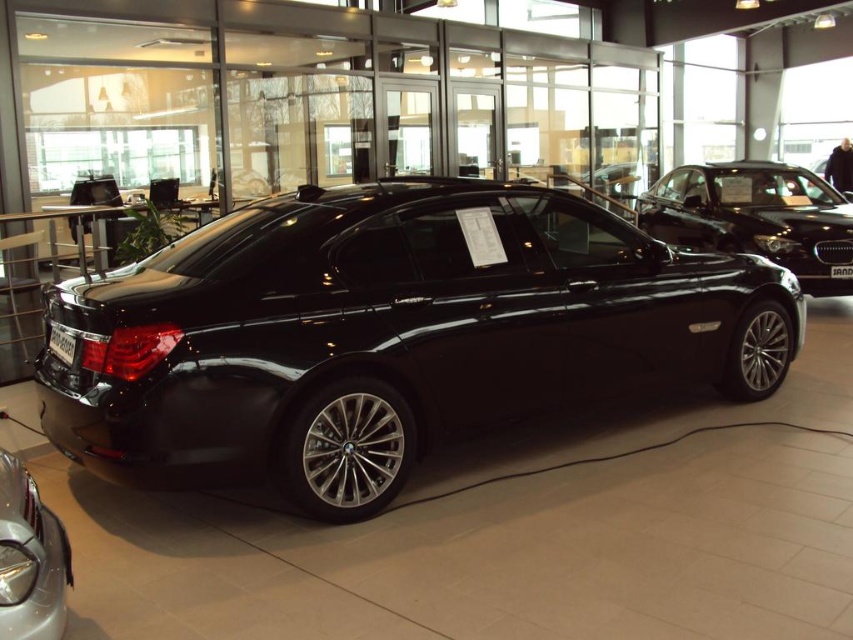
Between glossy black sedan at upper right and metallic silver car at lower left, which one appears on the right side from the viewer's perspective?

glossy black sedan at upper right is more to the right.

Who is positioned more to the left, glossy black sedan at upper right or metallic silver car at lower left?

From the viewer's perspective, metallic silver car at lower left appears more on the left side.

At what (x,y) coordinates should I click in order to perform the action: click on glossy black sedan at upper right. Please return your answer as a coordinate pair (x, y). The width and height of the screenshot is (853, 640). Looking at the image, I should click on (756, 218).

I want to click on glossy black sedan at upper right, so click(756, 218).

Can you confirm if black metallic car at center is positioned to the right of metallic silver car at lower left?

Yes, black metallic car at center is to the right of metallic silver car at lower left.

Is black metallic car at center to the left of metallic silver car at lower left from the viewer's perspective?

No, black metallic car at center is not to the left of metallic silver car at lower left.

Find the location of `black metallic car at center`. black metallic car at center is located at coordinates (387, 332).

Identify the location of black metallic car at center. (387, 332).

Consider the image. Is black metallic car at center shorter than glossy black sedan at upper right?

Yes, black metallic car at center is shorter than glossy black sedan at upper right.

Looking at this image, does black metallic car at center lie in front of glossy black sedan at upper right?

Yes, black metallic car at center is in front of glossy black sedan at upper right.

Is point (450, 241) closer to viewer compared to point (846, 236)?

Yes, it is in front of point (846, 236).

You are a GUI agent. You are given a task and a screenshot of the screen. Output one action in this format:
    pyautogui.click(x=<x>, y=<y>)
    Task: Click on the black metallic car at center
    
    Given the screenshot: What is the action you would take?
    pyautogui.click(x=387, y=332)